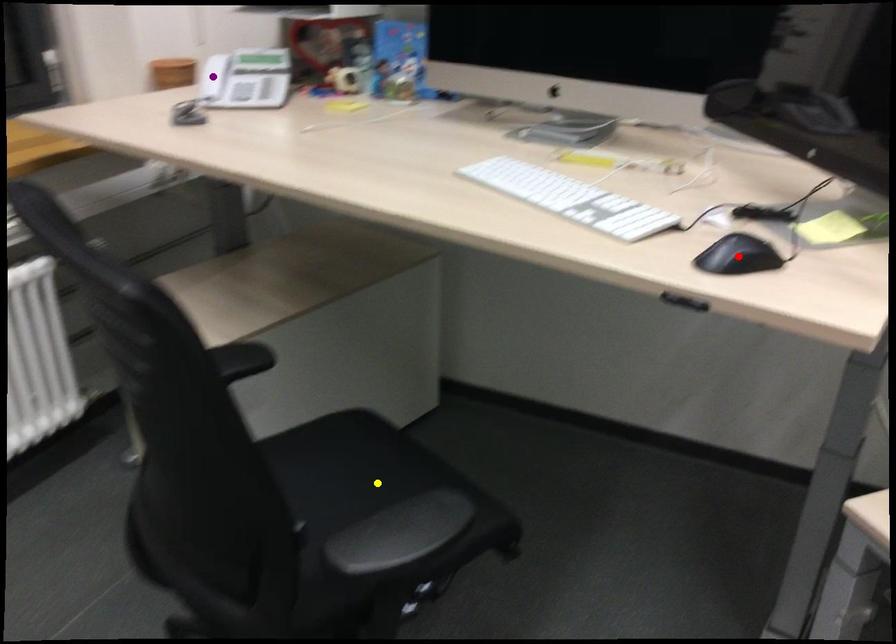
Order these from nearest to farthest:
purple point | yellow point | red point

red point
yellow point
purple point